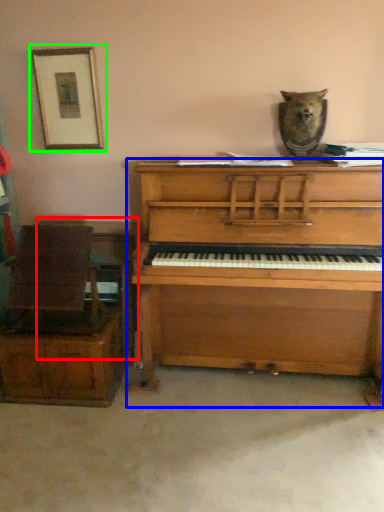
Question: Which object is the closest to the table (highlighted by a red box)? Choose among these: piano (highlighted by a blue box) or picture frame (highlighted by a green box).

Choices:
 (A) piano
 (B) picture frame

Answer: (A)